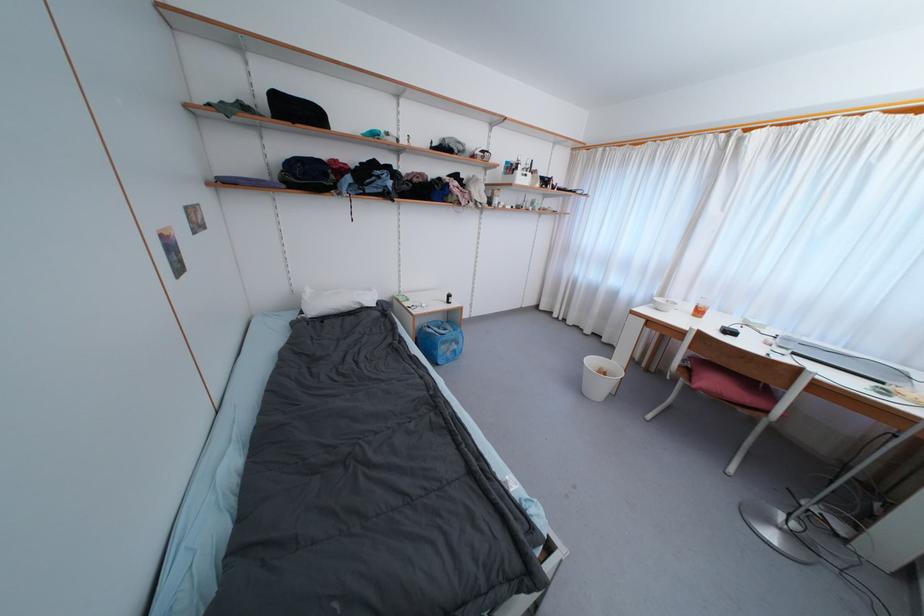
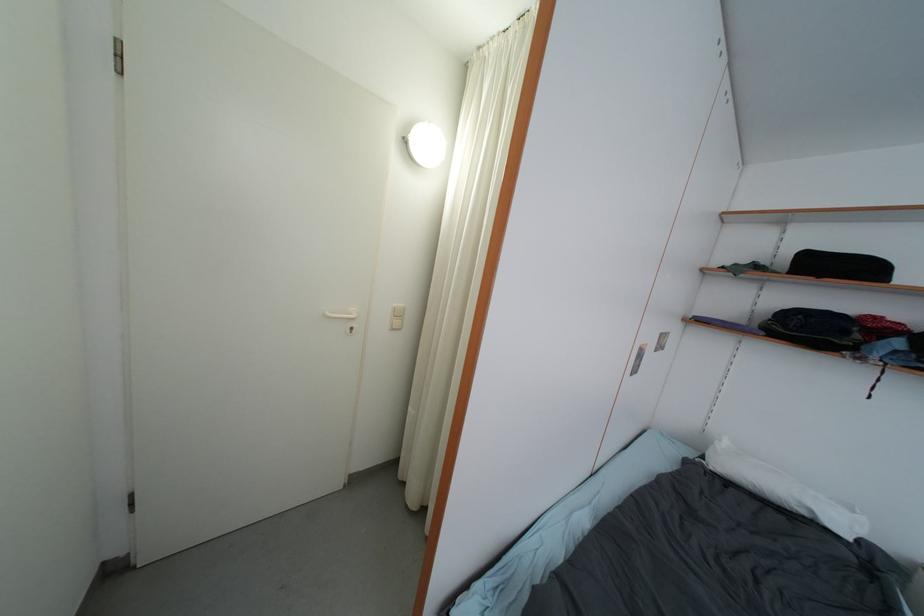
Question: The camera is either moving clockwise (left) or counter-clockwise (right) around the object. The first image is from the beginning of the video and the second image is from the end. Is the camera moving left or right when shooting the video?

Choices:
 (A) Left
 (B) Right

Answer: (B)